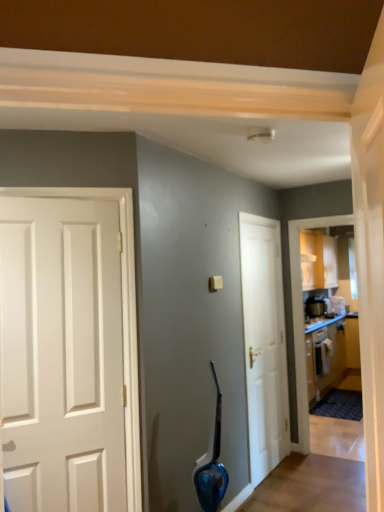
Question: From a real-world perspective, is wooden cabinetry at right physically above white glossy door at center?

Choices:
 (A) no
 (B) yes

Answer: (A)

Question: Is wooden cabinetry at right oriented towards white glossy door at center?

Choices:
 (A) no
 (B) yes

Answer: (A)

Question: Does wooden cabinetry at right appear on the right side of white glossy door at center?

Choices:
 (A) no
 (B) yes

Answer: (B)

Question: Is wooden cabinetry at right completely or partially outside of white glossy door at center?

Choices:
 (A) no
 (B) yes

Answer: (B)

Question: Can you confirm if wooden cabinetry at right is shorter than white glossy door at center?

Choices:
 (A) no
 (B) yes

Answer: (B)

Question: Looking at their shapes, would you say white glossy door at center is wider or thinner than metallic silver toaster at upper right, the second appliance in the left-to-right sequence?

Choices:
 (A) wide
 (B) thin

Answer: (B)

Question: Based on their positions, is white glossy door at center located to the left or right of metallic silver toaster at upper right, which is the first appliance in right-to-left order?

Choices:
 (A) right
 (B) left

Answer: (B)

Question: Is white glossy door at center spatially inside metallic silver toaster at upper right, which is the first appliance in right-to-left order, or outside of it?

Choices:
 (A) outside
 (B) inside

Answer: (A)

Question: From a real-world perspective, is white glossy door at center above or below metallic silver toaster at upper right, which is the first appliance in right-to-left order?

Choices:
 (A) below
 (B) above

Answer: (A)

Question: Is metallic silver toaster at right, which is the 1th appliance in left-to-right order, taller or shorter than white glossy door at center?

Choices:
 (A) tall
 (B) short

Answer: (B)

Question: Is metallic silver toaster at right, which is the 1th appliance in left-to-right order, bigger or smaller than white glossy door at center?

Choices:
 (A) small
 (B) big

Answer: (A)

Question: Is point (311, 306) positioned closer to the camera than point (261, 270)?

Choices:
 (A) farther
 (B) closer

Answer: (A)

Question: In the image, is metallic silver toaster at right, which is the 1th appliance in left-to-right order, positioned in front of or behind white glossy door at center?

Choices:
 (A) behind
 (B) front

Answer: (A)

Question: Considering the positions of wooden cabinetry at right and white glossy door at center in the image, is wooden cabinetry at right taller or shorter than white glossy door at center?

Choices:
 (A) short
 (B) tall

Answer: (A)

Question: Is wooden cabinetry at right to the left or to the right of white glossy door at center in the image?

Choices:
 (A) left
 (B) right

Answer: (B)